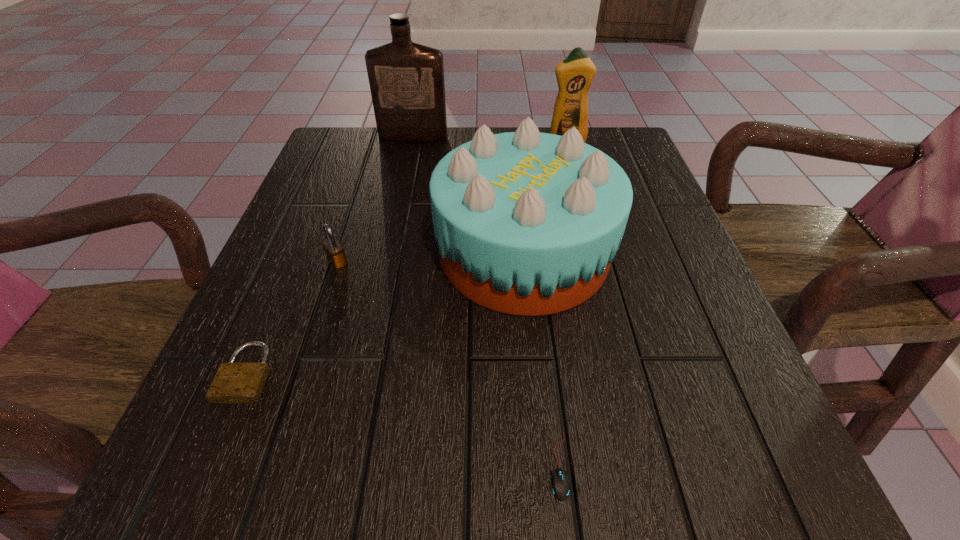
Locate an element on the screen. This screenshot has height=540, width=960. free space between the cake and the left padlock is located at coordinates (385, 313).

This screenshot has width=960, height=540. In order to click on free space between the shortest object and the cake in this screenshot , I will do `click(540, 359)`.

Identify the location of free area in between the cake and the farther padlock. (431, 257).

The image size is (960, 540). What are the coordinates of `free spot between the cake and the shortest object` in the screenshot? It's located at (540, 359).

Image resolution: width=960 pixels, height=540 pixels. I want to click on free spot between the right padlock and the nearest object, so click(x=447, y=363).

Locate which object ranks fourth in proximity to the detergent. Please provide its 2D coordinates. Your answer should be formatted as a tuple, i.e. [(x, y)], where the tuple contains the x and y coordinates of a point satisfying the conditions above.

[(559, 484)]

Identify which object is located as the fourth nearest to the shortest object. Please provide its 2D coordinates. Your answer should be formatted as a tuple, i.e. [(x, y)], where the tuple contains the x and y coordinates of a point satisfying the conditions above.

[(575, 73)]

Identify the location of free space that satisfies the following two spatial constraints: 1. on the label side of the tallest object; 2. on the left side of the mouse. (345, 465).

The image size is (960, 540). Find the location of `free space that satisfies the following two spatial constraints: 1. on the keyhole side of the nearest object; 2. on the left side of the fifth tallest object`. free space that satisfies the following two spatial constraints: 1. on the keyhole side of the nearest object; 2. on the left side of the fifth tallest object is located at coordinates (208, 465).

Find the location of a particular element. Image resolution: width=960 pixels, height=540 pixels. vacant area that satisfies the following two spatial constraints: 1. on the label side of the liquor; 2. on the left side of the mouse is located at coordinates (345, 465).